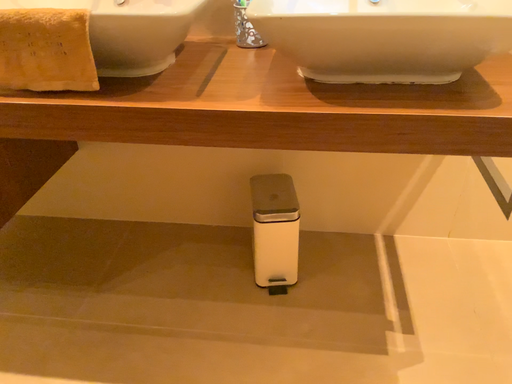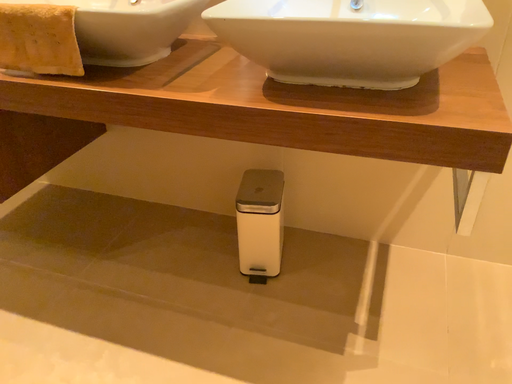
Question: How did the camera likely rotate when shooting the video?

Choices:
 (A) rotated left
 (B) rotated right

Answer: (A)